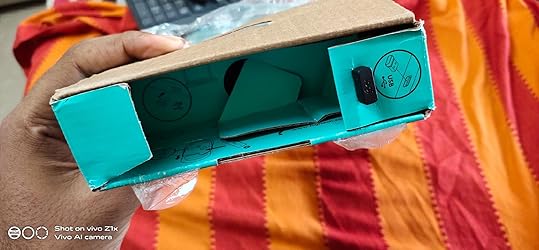
Locate an element on the screen. empty boxes is located at coordinates (172, 117).